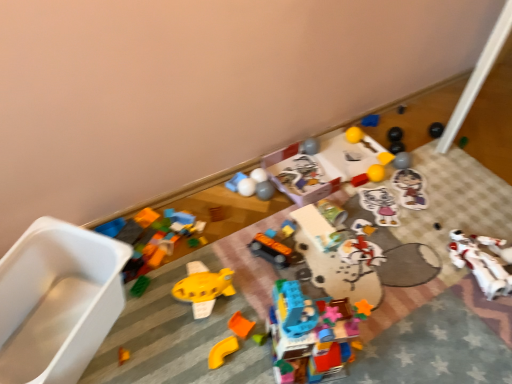
The image size is (512, 384). In order to click on vacant space in between orange matte block at center, which ranks as the fifth toy in left-to-right order, and translucent plastic building blocks at center, which ranks as the ninth toy in right-to-left order in this screenshot , I will do `click(253, 348)`.